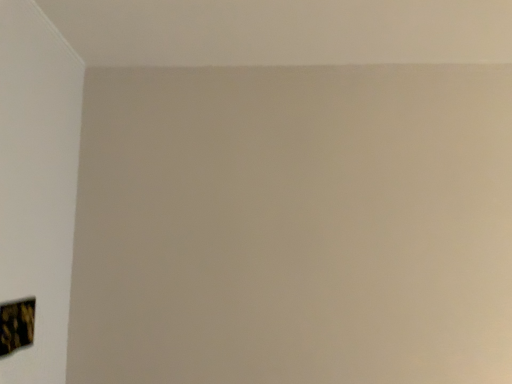
Measure the distance between wooden grain light switch at lower left and camera.

wooden grain light switch at lower left is 3.99 feet from camera.

Where is `wooden grain light switch at lower left`? wooden grain light switch at lower left is located at coordinates (16, 325).

The image size is (512, 384). What do you see at coordinates (16, 325) in the screenshot? I see `wooden grain light switch at lower left` at bounding box center [16, 325].

You are a GUI agent. You are given a task and a screenshot of the screen. Output one action in this format:
    pyautogui.click(x=<x>, y=<y>)
    Task: Click on the wooden grain light switch at lower left
    The width and height of the screenshot is (512, 384).
    Given the screenshot: What is the action you would take?
    pyautogui.click(x=16, y=325)